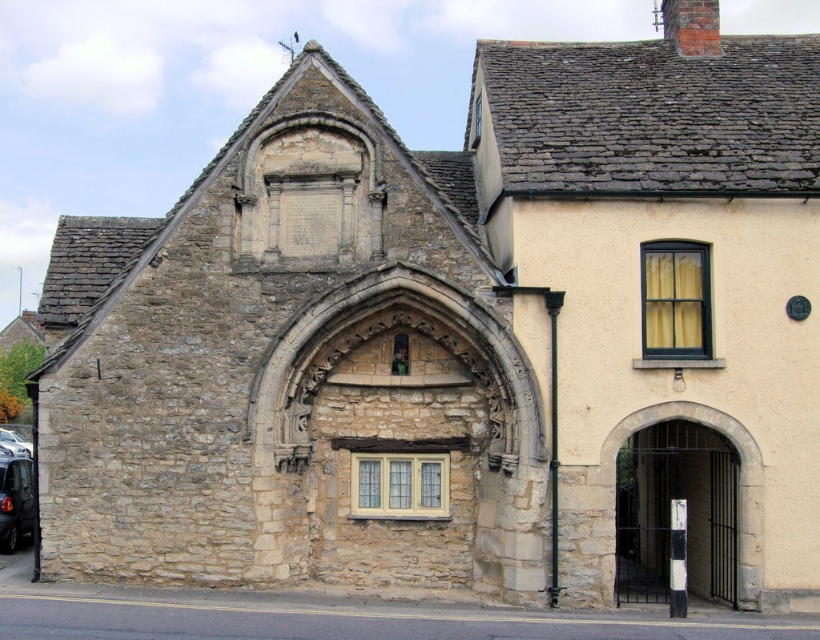
You are a delivery person who needs to park your truck between the dark gray metallic car at lower left and the metallic silver car at lower left. However, your truck is 2 meters tall. Can you safely park there without hitting the roof?

The dark gray metallic car at lower left is taller than the metallic silver car at lower left. Since the truck is 2 meters tall, if the taller car is over 2 meters, parking might not be safe. However, without specific height measurements, it is uncertain. Please check the actual height of the dark gray metallic car at lower left before deciding.

You are a photographer planning to capture both the dark gray metallic car at lower left and the metallic silver car at lower left in a single frame. Given their sizes, which car should you position closer to the camera to ensure both appear roughly the same size in the photo?

To make both cars appear roughly the same size in the photo, position the dark gray metallic car at lower left closer to the camera since it is smaller than the metallic silver car at lower left. This adjustment balances their apparent sizes due to perspective.

Consider the image. You are driving a car and want to exit the parking lot. You see a dark gray metallic car at lower left and a metallic silver car at lower left. Which car should you move around to exit without blocking the other car?

You should move around the dark gray metallic car at lower left because it is in front of the metallic silver car at lower left, so exiting behind the silver car would not block the dark gray one.